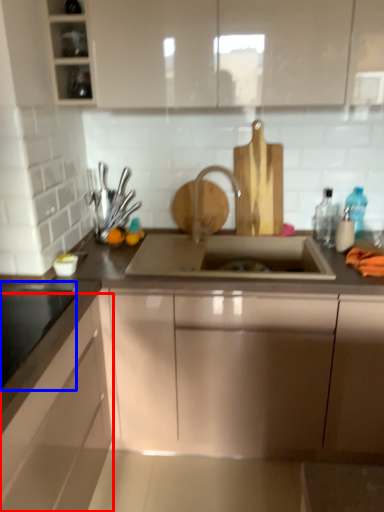
Question: Which point is further to the camera, cabinetry (highlighted by a red box) or appliance (highlighted by a blue box)?

Choices:
 (A) cabinetry
 (B) appliance

Answer: (B)